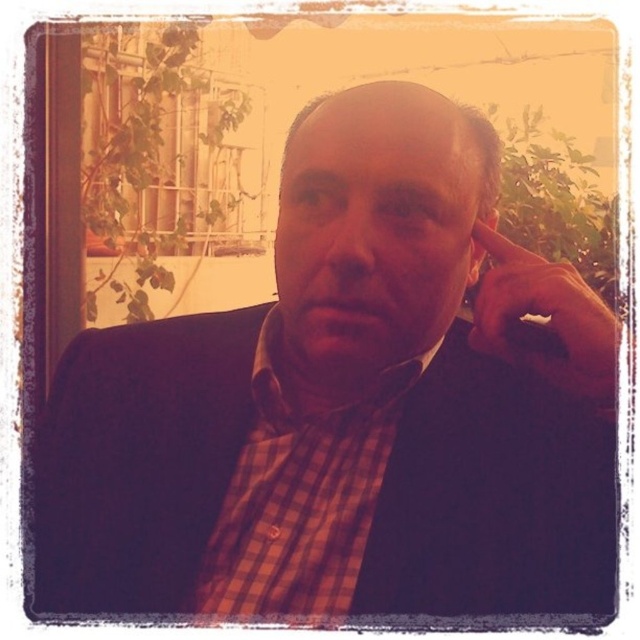
Between checkered fabric dress shirt at center and matte brown hand at upper right, which one appears on the right side from the viewer's perspective?

From the viewer's perspective, matte brown hand at upper right appears more on the right side.

This screenshot has width=640, height=640. I want to click on checkered fabric dress shirt at center, so click(x=300, y=496).

Identify the location of checkered fabric dress shirt at center. (300, 496).